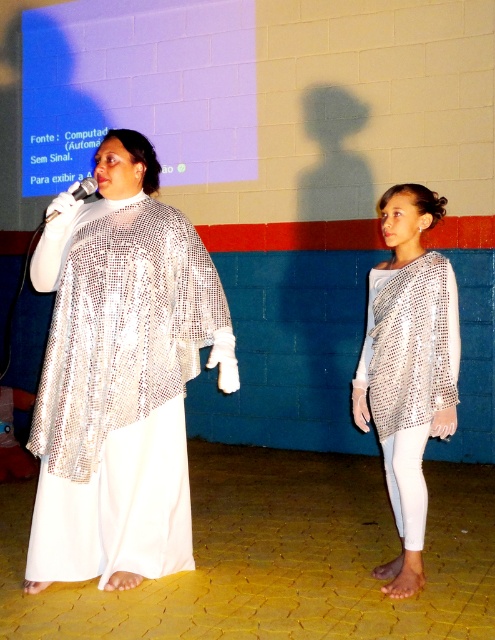
You are a stagehand who needs to ensure that the shiny metallic robe at left and the silver mesh top at center fit within a 2.5 meter wide stage backdrop. Given their widths, will both items fit side by side?

The shiny metallic robe at left is wider than the silver mesh top at center. However, without knowing their exact widths, it is impossible to determine if their combined width exceeds 2.5 meters. Additional measurements are needed.

You are an event organizer arranging a stage setup. You need to ensure that the shiny metallic robe at left and the silver mesh top at center are visible to the audience. Based on their positions, which one is closer to the front of the stage?

The shiny metallic robe at left is in front of the silver mesh top at center, so it is closer to the front of the stage.